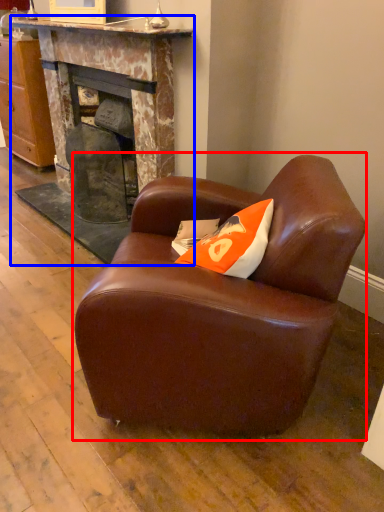
Question: Which object appears farthest to the camera in this image, chair (highlighted by a red box) or fireplace (highlighted by a blue box)?

Choices:
 (A) chair
 (B) fireplace

Answer: (B)